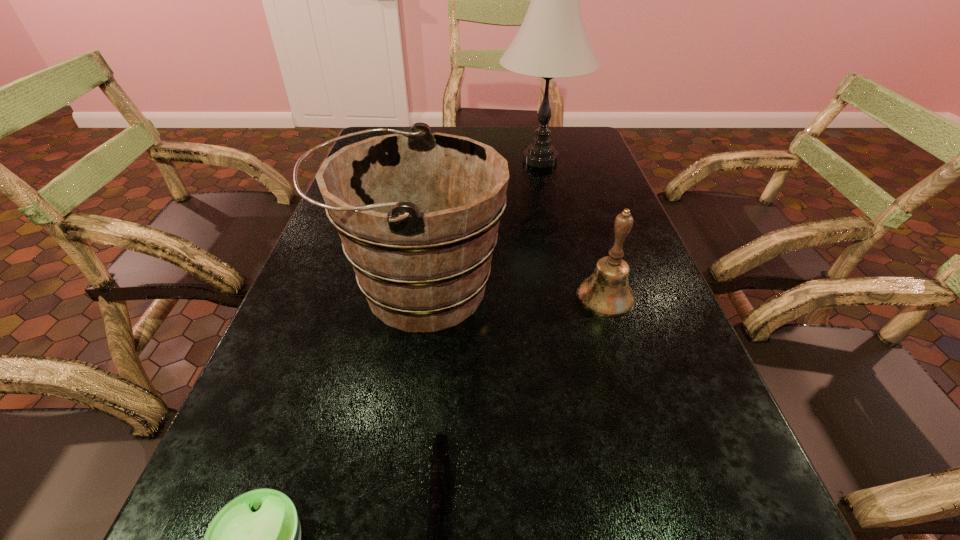
Identify the location of free spot that satisfies the following two spatial constraints: 1. on the handle side of the second tallest object; 2. on the right side of the tallest object. (438, 160).